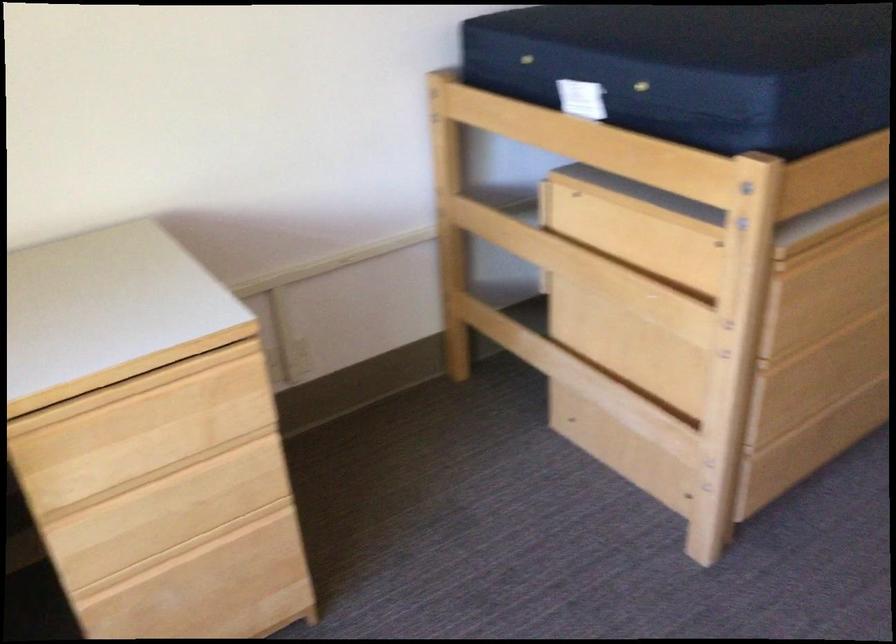
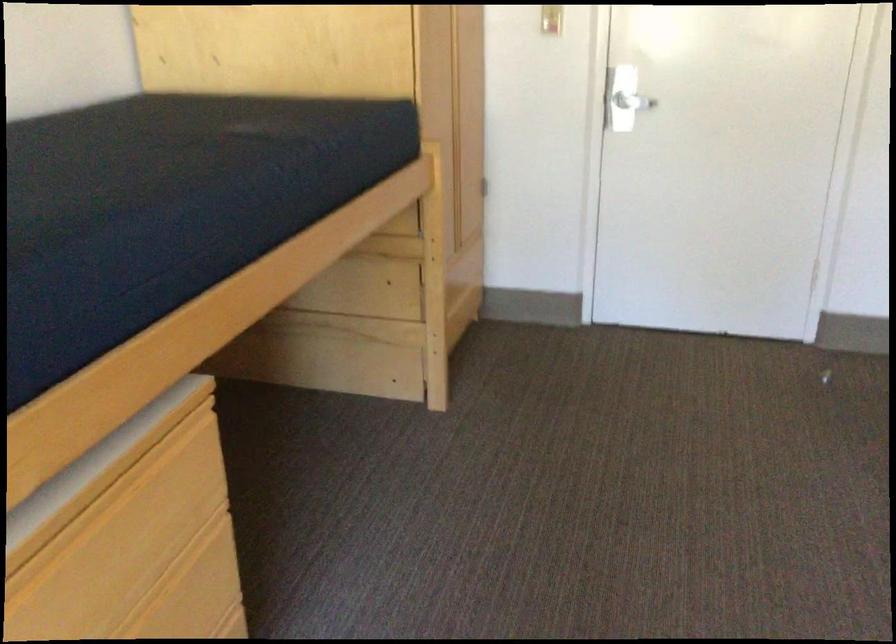
Question: How did the camera likely rotate?

Choices:
 (A) Left
 (B) Right
 (C) Up
 (D) Down

Answer: (B)